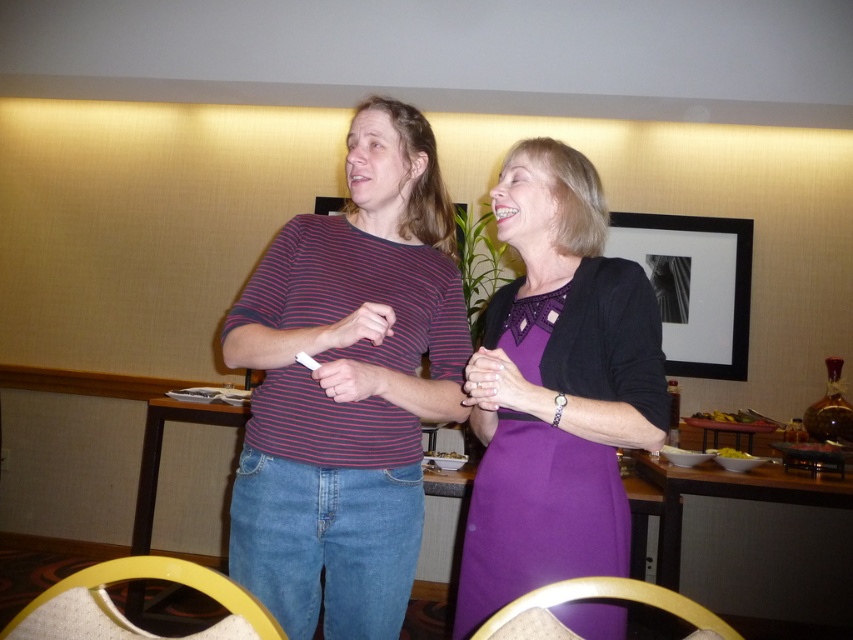
You are a photographer setting up for a portrait. You have a camera with a focal length of 50mm and want to ensure both the striped cotton shirt at center and the purple satin dress at center are in focus. According to the hyperfocal distance formula, what is the minimum distance you should set your focus to achieve sharpness for both subjects?

The minimum focus distance required to keep both the striped cotton shirt at center and the purple satin dress at center in focus is 9.42 inches.

You are a fashion designer observing two outfits in the image. The striped cotton shirt at center and the purple satin dress at center. Which outfit has a larger width?

The striped cotton shirt at center has a larger width than the purple satin dress at center according to the description.